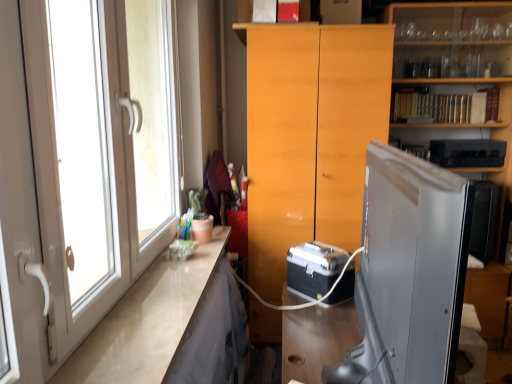
The width and height of the screenshot is (512, 384). I want to click on black plastic microwave at upper right, the 2th appliance when ordered from left to right, so click(x=467, y=153).

This screenshot has width=512, height=384. What do you see at coordinates (480, 179) in the screenshot?
I see `wooden bookshelf at upper right` at bounding box center [480, 179].

Describe the element at coordinates (310, 137) in the screenshot. I see `light wood cabinet at center` at that location.

What do you see at coordinates (145, 322) in the screenshot?
I see `white glossy counter top at left` at bounding box center [145, 322].

Locate an element on the screen. This screenshot has height=384, width=512. metallic silver briefcase at center, acting as the 1th appliance starting from the front is located at coordinates (314, 268).

Identify the location of black plastic microwave at upper right, which ranks as the second appliance in front-to-back order. (467, 153).

Between light wood cabinet at center and metallic silver briefcase at center, the second appliance from the back, which one has less height?

metallic silver briefcase at center, the second appliance from the back, is shorter.

Is light wood cabinet at center bigger than metallic silver briefcase at center, the second appliance from the back?

Yes.

Is point (378, 104) farther from viewer compared to point (301, 253)?

Yes, it is behind point (301, 253).

Can you confirm if light wood cabinet at center is thinner than metallic silver briefcase at center, which is the 2th appliance from top to bottom?

Incorrect, the width of light wood cabinet at center is not less than that of metallic silver briefcase at center, which is the 2th appliance from top to bottom.

Is white glossy door at left taller than light wood cabinet at center?

Incorrect, the height of white glossy door at left is not larger of that of light wood cabinet at center.

Is point (63, 54) closer to viewer compared to point (257, 106)?

Yes, it is in front of point (257, 106).

Find the location of a particular element. cabinetry that is below the white glossy door at left (from the image's perspective) is located at coordinates (310, 137).

Consider the image. Is wooden bookshelf at upper right thinner than black plastic microwave at upper right, which ranks as the second appliance in front-to-back order?

In fact, wooden bookshelf at upper right might be wider than black plastic microwave at upper right, which ranks as the second appliance in front-to-back order.

Looking at this image, considering the relative sizes of wooden bookshelf at upper right and black plastic microwave at upper right, arranged as the 1th appliance when viewed from the back, in the image provided, is wooden bookshelf at upper right taller than black plastic microwave at upper right, arranged as the 1th appliance when viewed from the back,?

Correct, wooden bookshelf at upper right is much taller as black plastic microwave at upper right, arranged as the 1th appliance when viewed from the back.

Is wooden bookshelf at upper right beside black plastic microwave at upper right, the 1th appliance when ordered from right to left?

No, wooden bookshelf at upper right is not making contact with black plastic microwave at upper right, the 1th appliance when ordered from right to left.

Is white glossy door at left to the left or to the right of wooden bookshelf at upper right in the image?

From the image, it's evident that white glossy door at left is to the left of wooden bookshelf at upper right.

From a real-world perspective, is white glossy door at left positioned above or below wooden bookshelf at upper right?

white glossy door at left is above wooden bookshelf at upper right.

Considering the sizes of objects white glossy door at left and wooden bookshelf at upper right in the image provided, who is bigger, white glossy door at left or wooden bookshelf at upper right?

wooden bookshelf at upper right is bigger.

From the image's perspective, is white glossy counter top at left under light wood cabinet at center?

Yes, from the image's perspective, white glossy counter top at left is beneath light wood cabinet at center.

Considering the sizes of objects white glossy counter top at left and light wood cabinet at center in the image provided, who is bigger, white glossy counter top at left or light wood cabinet at center?

Bigger between the two is light wood cabinet at center.

From a real-world perspective, is white glossy counter top at left positioned above or below light wood cabinet at center?

In terms of real-world spatial position, white glossy counter top at left is below light wood cabinet at center.

Between metallic silver briefcase at center, which is counted as the 1th appliance, starting from the left, and black plastic microwave at upper right, acting as the 2th appliance starting from the bottom, which one appears on the right side from the viewer's perspective?

Positioned to the right is black plastic microwave at upper right, acting as the 2th appliance starting from the bottom.

Relative to black plastic microwave at upper right, arranged as the 1th appliance when viewed from the top, is metallic silver briefcase at center, acting as the 1th appliance starting from the front, in front or behind?

metallic silver briefcase at center, acting as the 1th appliance starting from the front, is in front of black plastic microwave at upper right, arranged as the 1th appliance when viewed from the top.

Considering the sizes of metallic silver briefcase at center, the second appliance viewed from the right, and black plastic microwave at upper right, which ranks as the second appliance in front-to-back order, in the image, is metallic silver briefcase at center, the second appliance viewed from the right, taller or shorter than black plastic microwave at upper right, which ranks as the second appliance in front-to-back order,?

Considering their sizes, metallic silver briefcase at center, the second appliance viewed from the right, has more height than black plastic microwave at upper right, which ranks as the second appliance in front-to-back order.

Considering the sizes of objects metallic silver briefcase at center, which is counted as the 1th appliance, starting from the left, and black plastic microwave at upper right, the 2th appliance when ordered from left to right, in the image provided, who is wider, metallic silver briefcase at center, which is counted as the 1th appliance, starting from the left, or black plastic microwave at upper right, the 2th appliance when ordered from left to right,?

metallic silver briefcase at center, which is counted as the 1th appliance, starting from the left.

From the image's perspective, is light wood cabinet at center located above or below wooden bookshelf at upper right?

From the image's perspective, light wood cabinet at center appears below wooden bookshelf at upper right.

Is light wood cabinet at center placed right next to wooden bookshelf at upper right?

light wood cabinet at center and wooden bookshelf at upper right are clearly separated.

Identify the location of cabinetry in front of the wooden bookshelf at upper right. The image size is (512, 384). (310, 137).

Can you confirm if light wood cabinet at center is wider than wooden bookshelf at upper right?

No, light wood cabinet at center is not wider than wooden bookshelf at upper right.

Find the location of a particular element. cabinetry lying on the right of metallic silver briefcase at center, the second appliance from the back is located at coordinates (310, 137).

Locate an element on the screen. cabinetry behind the white glossy door at left is located at coordinates (310, 137).

Looking at the image, which one is located further to metallic silver briefcase at center, the second appliance from the back, wooden bookshelf at upper right or white glossy door at left?

wooden bookshelf at upper right lies further to metallic silver briefcase at center, the second appliance from the back, than the other object.

Considering their positions, is metallic silver briefcase at center, the second appliance from the back, positioned further to white glossy door at left than wooden bookshelf at upper right?

wooden bookshelf at upper right is further to white glossy door at left.

When comparing their distances from white glossy door at left, does metallic silver briefcase at center, the second appliance viewed from the right, or light wood cabinet at center seem further?

light wood cabinet at center is further to white glossy door at left.

In the scene shown: From the image, which object appears to be nearer to white glossy door at left, metallic silver briefcase at center, which is counted as the 1th appliance, starting from the left, or white glossy counter top at left?

white glossy counter top at left is positioned closer to the anchor white glossy door at left.

When comparing their distances from white glossy counter top at left, does wooden bookshelf at upper right or metallic silver briefcase at center, acting as the 1th appliance starting from the bottom, seem further?

The object further to white glossy counter top at left is wooden bookshelf at upper right.

Based on their spatial positions, is light wood cabinet at center or metallic silver briefcase at center, acting as the 1th appliance starting from the bottom, closer to white glossy door at left?

Among the two, metallic silver briefcase at center, acting as the 1th appliance starting from the bottom, is located nearer to white glossy door at left.

Based on their spatial positions, is light wood cabinet at center or white glossy door at left closer to metallic silver briefcase at center, the second appliance from the back?

light wood cabinet at center is positioned closer to the anchor metallic silver briefcase at center, the second appliance from the back.

Looking at the image, which one is located further to white glossy counter top at left, black plastic microwave at upper right, acting as the 2th appliance starting from the bottom, or light wood cabinet at center?

black plastic microwave at upper right, acting as the 2th appliance starting from the bottom.

Image resolution: width=512 pixels, height=384 pixels. I want to click on shelf situated between white glossy door at left and black plastic microwave at upper right, arranged as the 1th appliance when viewed from the back, from left to right, so click(x=480, y=179).

The width and height of the screenshot is (512, 384). I want to click on counter top between white glossy door at left and black plastic microwave at upper right, the 1th appliance when ordered from right to left, from left to right, so click(145, 322).

Locate an element on the screen. appliance between white glossy door at left and wooden bookshelf at upper right in the horizontal direction is located at coordinates (314, 268).

The width and height of the screenshot is (512, 384). I want to click on shelf between metallic silver briefcase at center, the second appliance viewed from the right, and black plastic microwave at upper right, arranged as the 1th appliance when viewed from the top, in the horizontal direction, so click(480, 179).